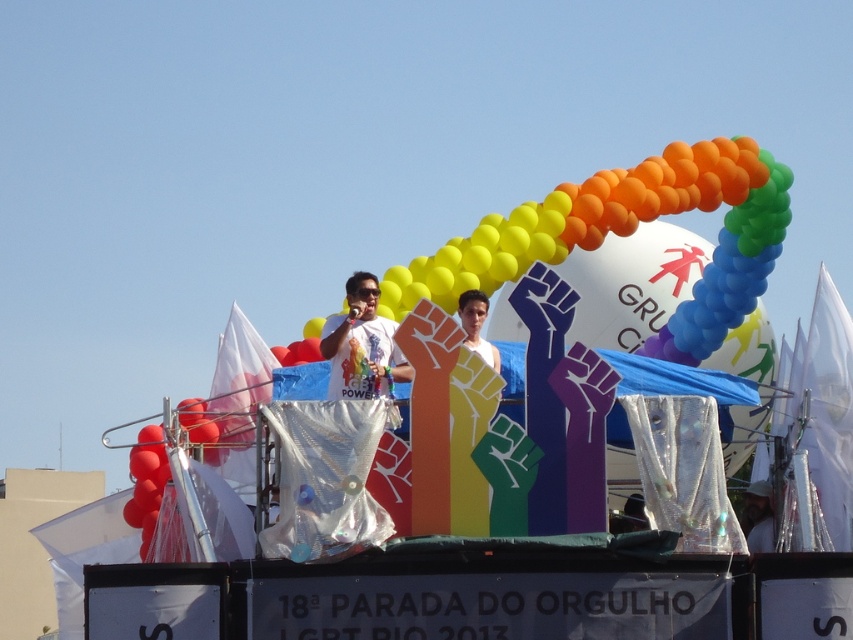
You are a photographer at the Pride parade and want to capture both the white fabric at center and the white matte shirt at center in the same frame. Which object should you focus on first to ensure both are in the shot?

The white fabric at center is positioned on the right side of the white matte shirt at center, so you should focus on the white matte shirt at center first to ensure both are included in the frame.